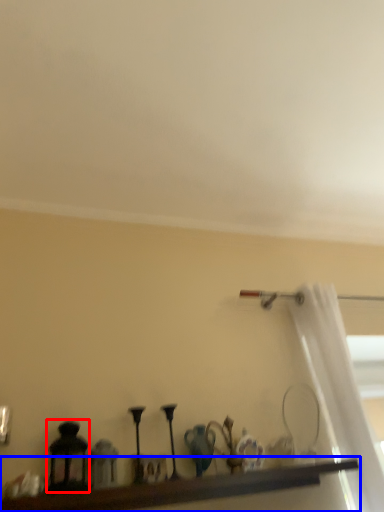
Question: Among these objects, which one is nearest to the camera, candle holder (highlighted by a red box) or shelf (highlighted by a blue box)?

Choices:
 (A) candle holder
 (B) shelf

Answer: (B)